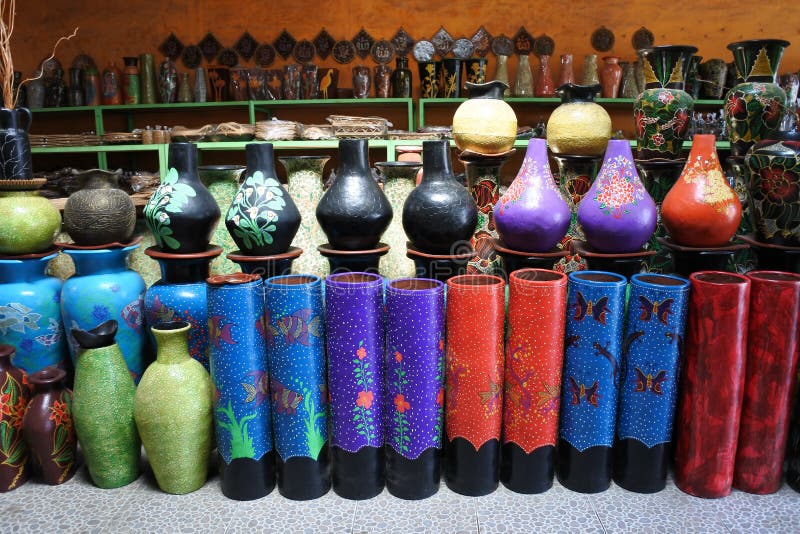
What are the coordinates of `purple vases` in the screenshot? It's located at (657, 209), (534, 217).